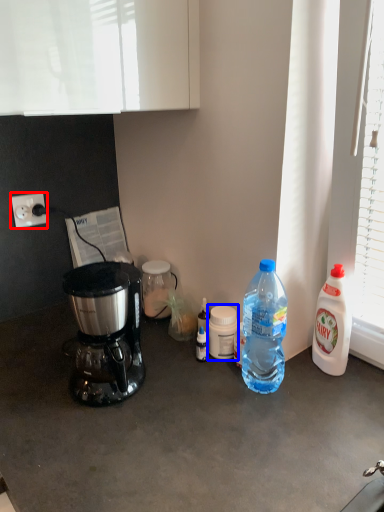
Question: Which of the following is the farthest to the observer, power outlet (highlighted by a red box) or bottle (highlighted by a blue box)?

Choices:
 (A) power outlet
 (B) bottle

Answer: (A)